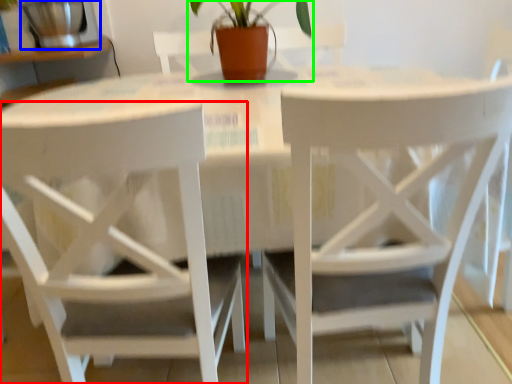
Question: Which is farther away from chair (highlighted by a red box)? appliance (highlighted by a blue box) or houseplant (highlighted by a green box)?

Choices:
 (A) appliance
 (B) houseplant

Answer: (A)